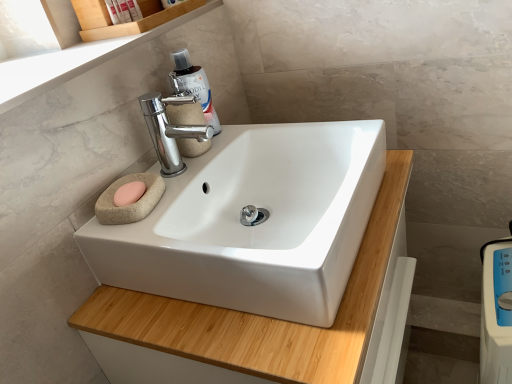
Question: From the image's perspective, is translucent plastic bottle at upper center on top of matte plastic soap at upper left, the second toiletry when ordered from right to left?

Choices:
 (A) yes
 (B) no

Answer: (B)

Question: Is translucent plastic bottle at upper center in front of matte plastic soap at upper left, which is the 1th toiletry in left-to-right order?

Choices:
 (A) no
 (B) yes

Answer: (B)

Question: From a real-world perspective, is translucent plastic bottle at upper center over matte plastic soap at upper left, which is the 1th toiletry in left-to-right order?

Choices:
 (A) yes
 (B) no

Answer: (B)

Question: Is translucent plastic bottle at upper center aimed at matte plastic soap at upper left, which is the 1th toiletry in left-to-right order?

Choices:
 (A) no
 (B) yes

Answer: (A)

Question: Is translucent plastic bottle at upper center to the left of matte plastic soap at upper left, the second toiletry when ordered from right to left, from the viewer's perspective?

Choices:
 (A) no
 (B) yes

Answer: (A)

Question: Considering the relative positions of white plastic scale at lower right and translucent plastic bottle at upper center in the image provided, is white plastic scale at lower right to the left or to the right of translucent plastic bottle at upper center?

Choices:
 (A) left
 (B) right

Answer: (B)

Question: Would you say white plastic scale at lower right is inside or outside translucent plastic bottle at upper center?

Choices:
 (A) inside
 (B) outside

Answer: (B)

Question: In terms of width, does white plastic scale at lower right look wider or thinner when compared to translucent plastic bottle at upper center?

Choices:
 (A) wide
 (B) thin

Answer: (A)

Question: From a real-world perspective, is white plastic scale at lower right positioned above or below translucent plastic bottle at upper center?

Choices:
 (A) below
 (B) above

Answer: (A)

Question: Does point (176, 172) appear closer or farther from the camera than point (401, 173)?

Choices:
 (A) farther
 (B) closer

Answer: (B)

Question: Looking at their shapes, would you say polished chrome faucet at upper center is wider or thinner than white glossy sink at center?

Choices:
 (A) thin
 (B) wide

Answer: (A)

Question: Is polished chrome faucet at upper center to the left or to the right of white glossy sink at center in the image?

Choices:
 (A) left
 (B) right

Answer: (A)

Question: In terms of size, does polished chrome faucet at upper center appear bigger or smaller than white glossy sink at center?

Choices:
 (A) small
 (B) big

Answer: (A)

Question: From a real-world perspective, relative to white plastic bottle at upper left, acting as the 2th toiletry starting from the left, is translucent plastic bottle at upper center vertically above or below?

Choices:
 (A) below
 (B) above

Answer: (A)

Question: Is translucent plastic bottle at upper center bigger or smaller than white plastic bottle at upper left, placed as the first toiletry when sorted from right to left?

Choices:
 (A) small
 (B) big

Answer: (B)